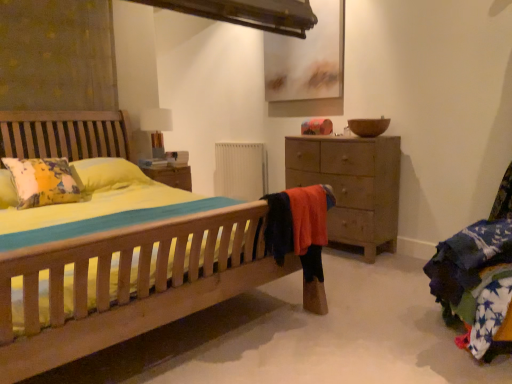
Question: In terms of size, does white fabric table lamp at upper center appear bigger or smaller than wooden chest of drawers at right?

Choices:
 (A) small
 (B) big

Answer: (A)

Question: Considering the positions of point (165, 119) and point (326, 157), is point (165, 119) closer or farther from the camera than point (326, 157)?

Choices:
 (A) farther
 (B) closer

Answer: (A)

Question: Based on their relative distances, which object is nearer to the white fabric table lamp at upper center?

Choices:
 (A) white matte radiator at center
 (B) wooden chest of drawers at right

Answer: (A)

Question: Which is nearer to the white fabric table lamp at upper center?

Choices:
 (A) white matte radiator at center
 (B) wooden chest of drawers at right

Answer: (A)